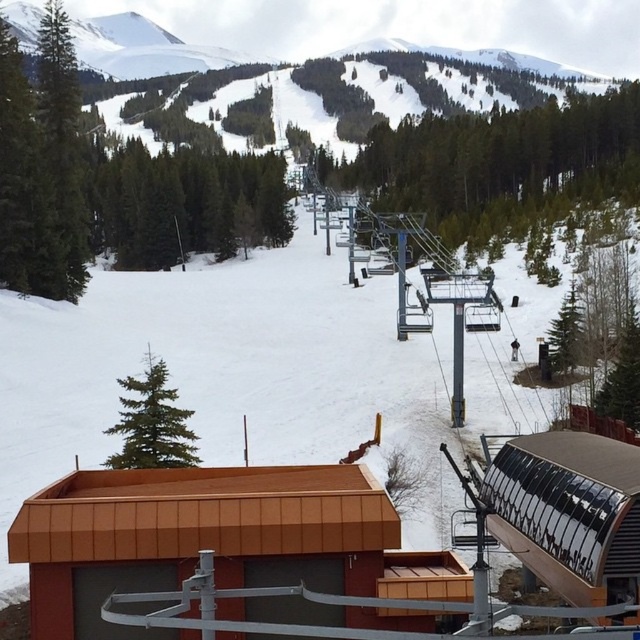
Question: Is brown corrugated metal ski resort at center smaller than green matte pine at upper left?

Choices:
 (A) no
 (B) yes

Answer: (B)

Question: Which of the following is the farthest from the observer?

Choices:
 (A) (221, 520)
 (B) (160, 436)
 (C) (515, 356)

Answer: (C)

Question: Is green matte pine at upper left positioned behind black fabric skier at center-right?

Choices:
 (A) yes
 (B) no

Answer: (B)

Question: Can you confirm if brown corrugated metal ski resort at center is thinner than black fabric skier at center-right?

Choices:
 (A) no
 (B) yes

Answer: (A)

Question: Which point is closer to the camera taking this photo?

Choices:
 (A) (515, 344)
 (B) (76, 600)
 (C) (160, 444)

Answer: (B)

Question: Which is nearer to the green matte pine at upper left?

Choices:
 (A) black fabric skier at center-right
 (B) brown corrugated metal ski resort at center

Answer: (B)